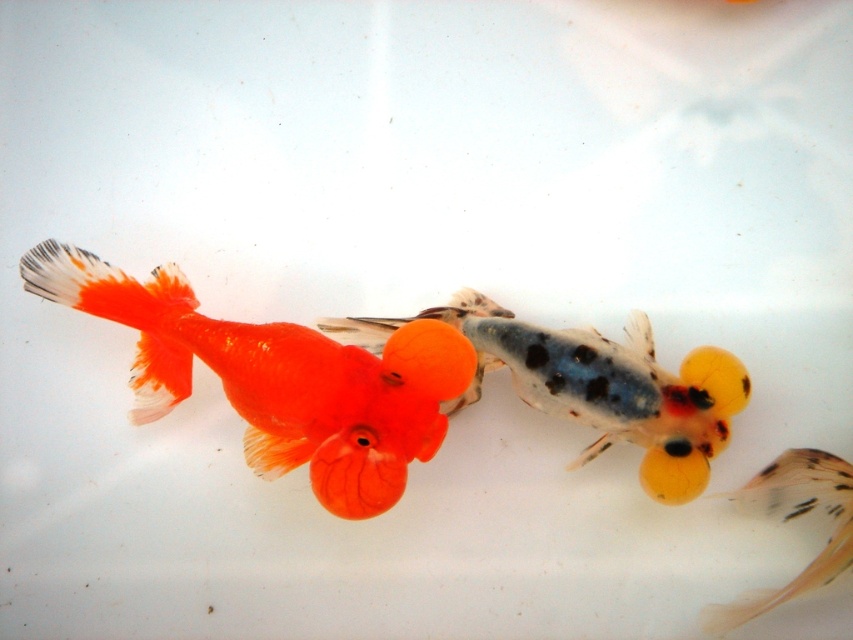
Question: Which point appears closest to the camera in this image?

Choices:
 (A) (329, 408)
 (B) (601, 412)
 (C) (840, 538)

Answer: (C)

Question: Considering the real-world distances, which object is closest to the translucent orange fish at lower right?

Choices:
 (A) translucent orange goldfish at center
 (B) shiny orange goldfish at left

Answer: (A)

Question: Does shiny orange goldfish at left have a lesser width compared to translucent orange fish at lower right?

Choices:
 (A) no
 (B) yes

Answer: (A)

Question: Is translucent orange goldfish at center wider than translucent orange fish at lower right?

Choices:
 (A) no
 (B) yes

Answer: (B)

Question: Which point is closer to the camera?

Choices:
 (A) (737, 609)
 (B) (453, 403)
 (C) (326, 406)

Answer: (A)

Question: Is shiny orange goldfish at left above translucent orange goldfish at center?

Choices:
 (A) yes
 (B) no

Answer: (A)